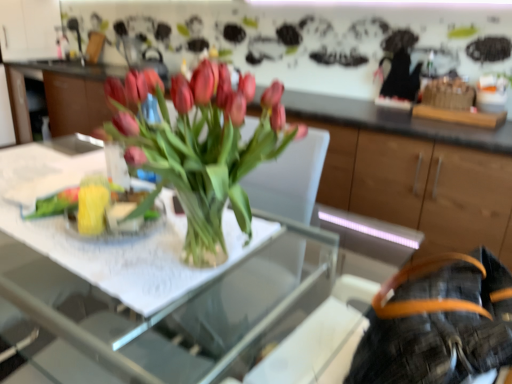
Question: From a real-world perspective, is orange leather belt at lower right above or below clear glass vase at center?

Choices:
 (A) below
 (B) above

Answer: (A)

Question: Is point (415, 319) closer or farther from the camera than point (122, 150)?

Choices:
 (A) farther
 (B) closer

Answer: (B)

Question: Considering the real-world distances, which object is closest to the matte wood cabinet at center?

Choices:
 (A) clear glass vase at center
 (B) clear glass table at center
 (C) orange leather belt at lower right

Answer: (B)

Question: Which object is positioned farthest from the clear glass table at center?

Choices:
 (A) orange leather belt at lower right
 (B) matte wood cabinet at center
 (C) clear glass vase at center

Answer: (B)